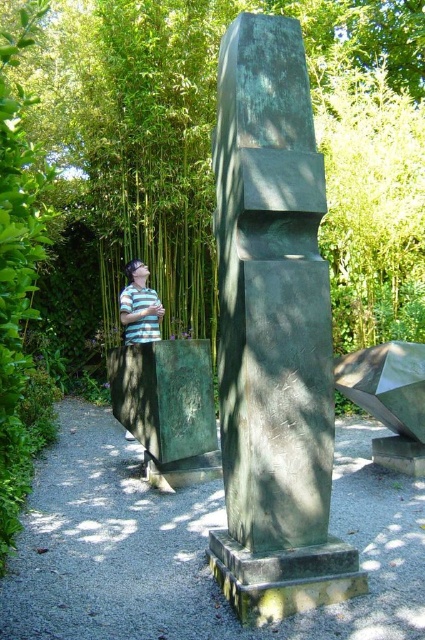
You are standing at the origin point in the image. The green stone sculpture at center is located at coordinates 0.523 in the x direction and 0.642 in the y direction. If you want to walk directly towards the sculpture, which direction should you move in terms of x and y coordinates?

To move directly towards the green stone sculpture at center, you should increase your x coordinate to 0.523 and increase your y coordinate to 0.642.

You are standing at the position of the striped shirt at lower left. Which direction should you face to see the green stone sculpture at center?

You should face to the right to see the green stone sculpture at center since it is located to the right of the striped shirt at lower left.

You are a delivery person with a cart that is 2 meters wide. You need to move from the gray gravel path at center to the striped shirt at lower left. Can your cart fit through the space between them?

The distance between the gray gravel path at center and the striped shirt at lower left is 1.89 meters, which is narrower than your 2 meter wide cart. Therefore, your cart cannot fit through the space between them.